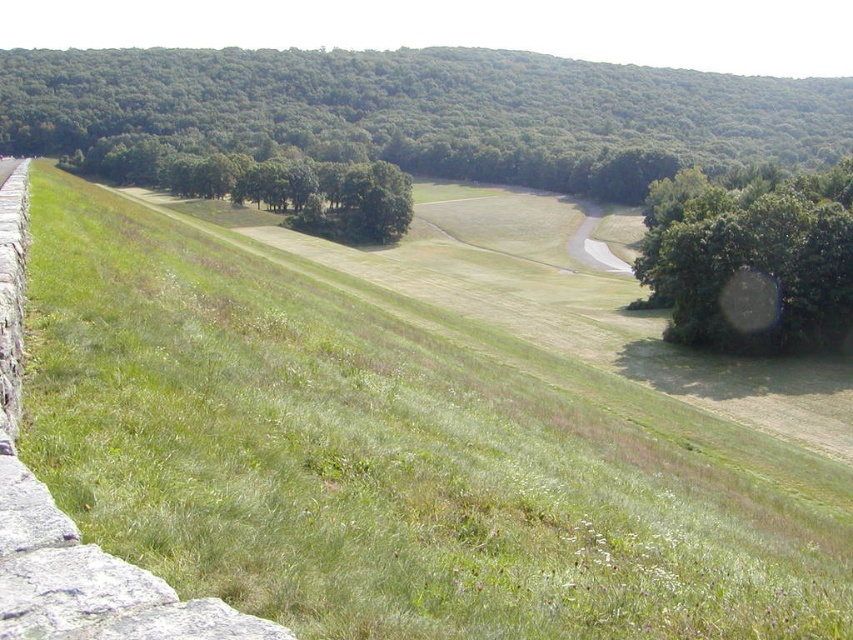
Question: Among these objects, which one is farthest from the camera?

Choices:
 (A) green leafy tree at center
 (B) green grassy slope at left
 (C) green leafy trees at center
 (D) green leafy tree at center right

Answer: (A)

Question: Which point is closer to the camera?

Choices:
 (A) (334, 467)
 (B) (646, 285)

Answer: (A)

Question: Does green leafy tree at center lie behind green leafy tree at center right?

Choices:
 (A) yes
 (B) no

Answer: (A)

Question: Is green grassy slope at left smaller than green leafy trees at center?

Choices:
 (A) no
 (B) yes

Answer: (B)

Question: Does green grassy slope at left have a larger size compared to green leafy tree at center?

Choices:
 (A) yes
 (B) no

Answer: (B)

Question: Which object is the closest to the green leafy tree at center right?

Choices:
 (A) green leafy tree at center
 (B) green grassy slope at left

Answer: (B)